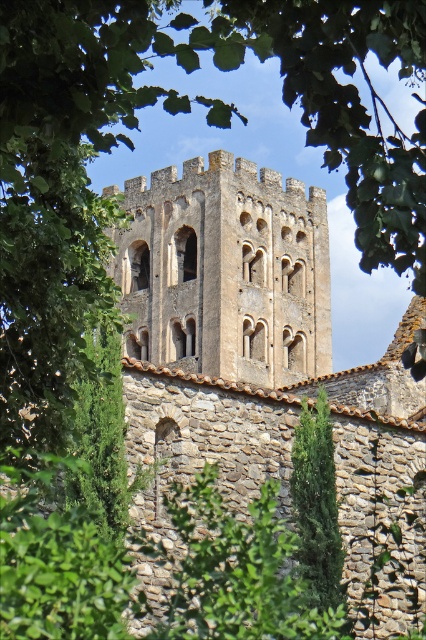
You are an architect inspecting a historic site. You observe two towers in the scene, the brown stone tower at center and the green textured stone tower at center. Which tower is taller?

The brown stone tower at center is taller than the green textured stone tower at center.

You are standing in a field and see both the brown stone tower at center and the green textured stone tower at center. Which tower is closer to you?

The brown stone tower at center is closer to you since it is only 10.96 meters away from the green textured stone tower at center, and since both are at the same center position, the brown one is in front.